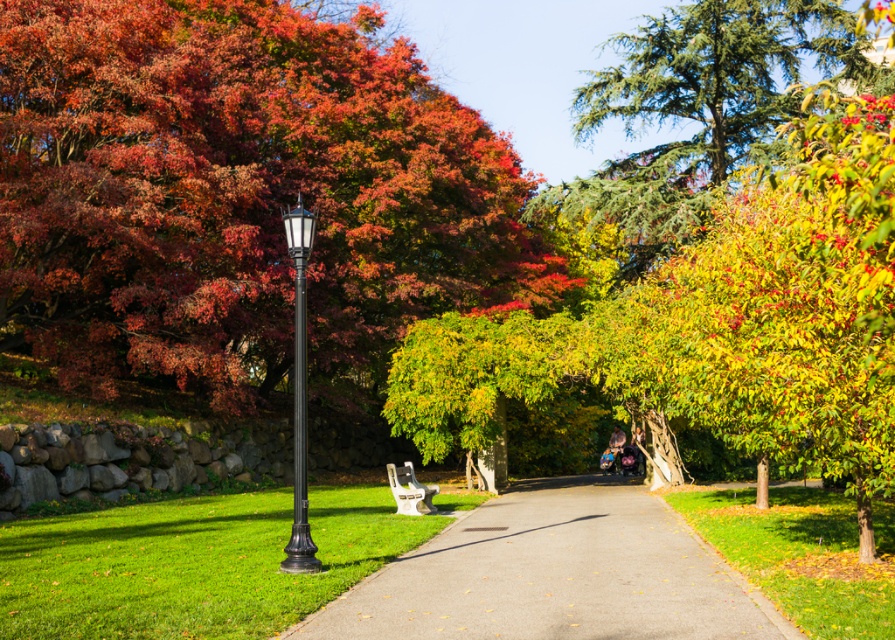
Question: Is the position of black metal lamp post at left more distant than that of white plastic bench at center?

Choices:
 (A) yes
 (B) no

Answer: (B)

Question: Where is smooth asphalt path at center located in relation to black metal lamp post at left in the image?

Choices:
 (A) right
 (B) left

Answer: (A)

Question: Which point appears closest to the camera in this image?

Choices:
 (A) (300, 566)
 (B) (128, 84)
 (C) (444, 579)

Answer: (C)

Question: Estimate the real-world distances between objects in this image. Which object is farther from the autumn leaves at upper left?

Choices:
 (A) white plastic bench at center
 (B) smooth asphalt path at center
 (C) black metal lamp post at left

Answer: (C)

Question: Is autumn leaves at upper left closer to the viewer compared to white plastic bench at center?

Choices:
 (A) no
 (B) yes

Answer: (A)

Question: Which point appears farthest from the camera in this image?

Choices:
 (A) (652, 520)
 (B) (407, 509)

Answer: (B)